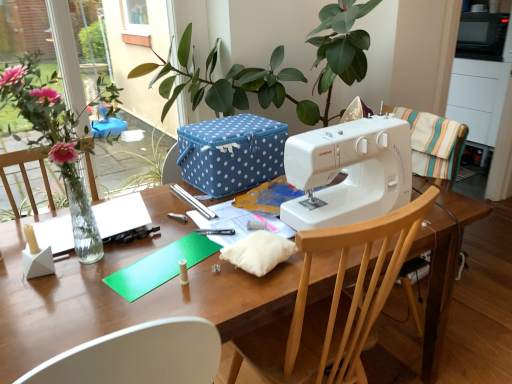
Question: Is the position of wooden table at center less distant than that of wooden chair at right, positioned as the second chair in left-to-right order?

Choices:
 (A) no
 (B) yes

Answer: (B)

Question: Does wooden table at center have a lesser width compared to wooden chair at right, which appears as the first chair when viewed from the top?

Choices:
 (A) no
 (B) yes

Answer: (A)

Question: Considering the relative positions of wooden table at center and wooden chair at right, which appears as the first chair when viewed from the top, in the image provided, is wooden table at center behind wooden chair at right, which appears as the first chair when viewed from the top,?

Choices:
 (A) yes
 (B) no

Answer: (B)

Question: Considering the relative sizes of wooden table at center and wooden chair at right, positioned as the second chair in left-to-right order, in the image provided, is wooden table at center smaller than wooden chair at right, positioned as the second chair in left-to-right order,?

Choices:
 (A) no
 (B) yes

Answer: (A)

Question: Can you confirm if wooden table at center is wider than wooden chair at right, marked as the second chair in a bottom-to-top arrangement?

Choices:
 (A) yes
 (B) no

Answer: (A)

Question: Considering the relative positions of blue polka dot fabric box at center and white plastic sewing machine at center in the image provided, is blue polka dot fabric box at center to the left or to the right of white plastic sewing machine at center?

Choices:
 (A) left
 (B) right

Answer: (A)

Question: In terms of width, does blue polka dot fabric box at center look wider or thinner when compared to white plastic sewing machine at center?

Choices:
 (A) thin
 (B) wide

Answer: (B)

Question: Is blue polka dot fabric box at center taller or shorter than white plastic sewing machine at center?

Choices:
 (A) short
 (B) tall

Answer: (A)

Question: Choose the correct answer: Is blue polka dot fabric box at center inside white plastic sewing machine at center or outside it?

Choices:
 (A) outside
 (B) inside

Answer: (A)

Question: Is blue polka dot fabric box at center inside or outside of wooden chair at center, placed as the 1th chair when sorted from left to right?

Choices:
 (A) inside
 (B) outside

Answer: (B)

Question: In terms of height, does blue polka dot fabric box at center look taller or shorter compared to wooden chair at center, which appears as the second chair when viewed from the right?

Choices:
 (A) short
 (B) tall

Answer: (A)

Question: Would you say blue polka dot fabric box at center is to the left or to the right of wooden chair at center, placed as the 1th chair when sorted from left to right, in the picture?

Choices:
 (A) left
 (B) right

Answer: (A)

Question: Is blue polka dot fabric box at center wider or thinner than wooden chair at center, placed as the 1th chair when sorted from left to right?

Choices:
 (A) wide
 (B) thin

Answer: (B)

Question: Is green leafy plant at left bigger or smaller than wooden table at center?

Choices:
 (A) big
 (B) small

Answer: (B)

Question: From a real-world perspective, is green leafy plant at left above or below wooden table at center?

Choices:
 (A) below
 (B) above

Answer: (B)